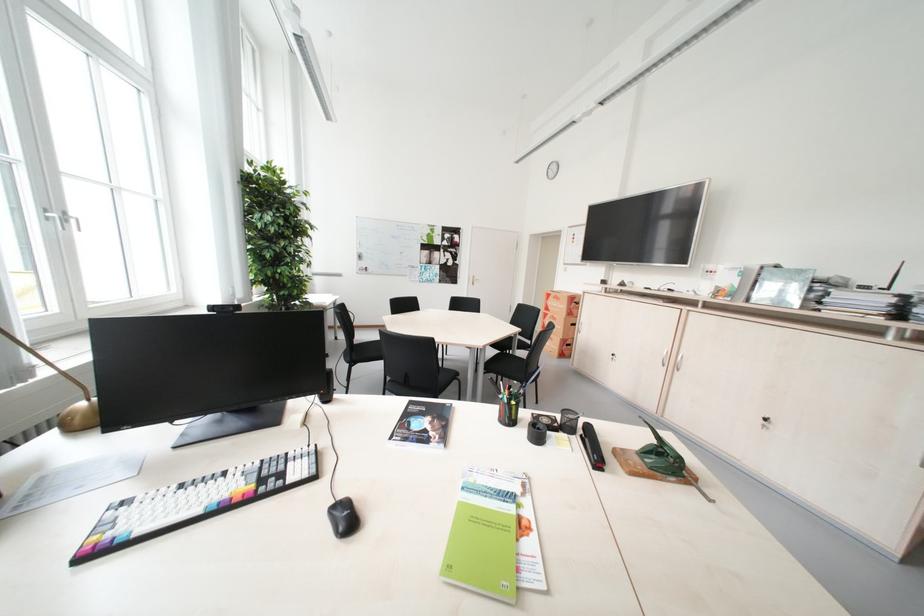
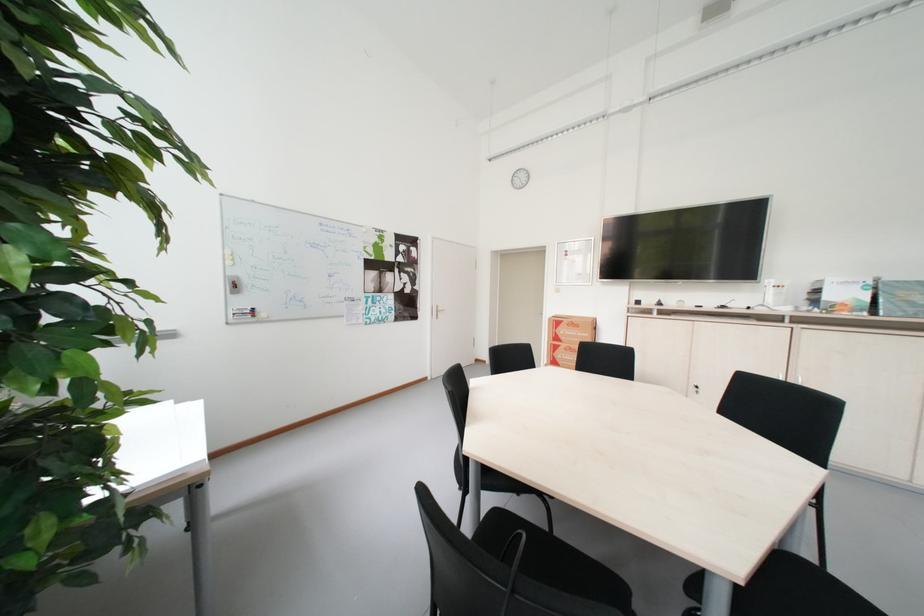
Find the pixel in the second image that matches point 556,310 in the first image.

(565, 341)